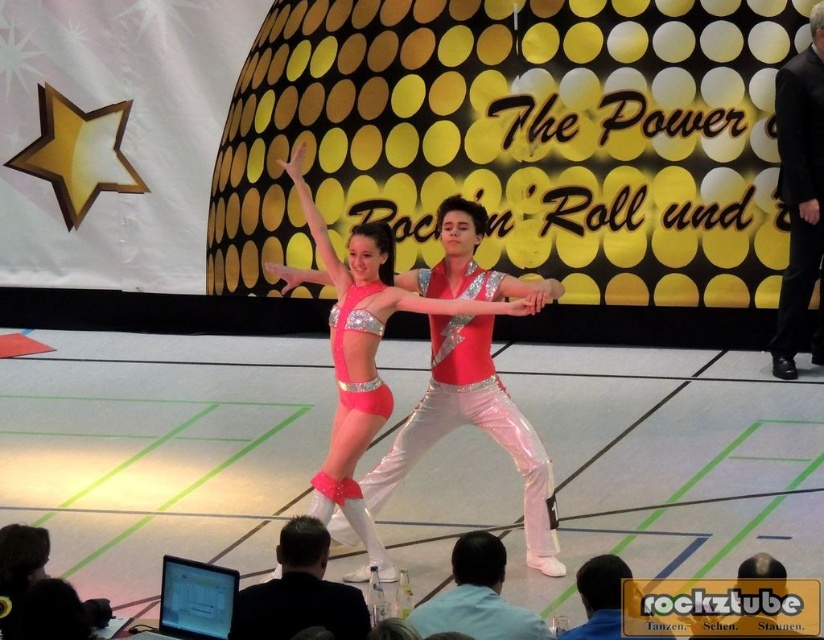
You are a stagehand preparing to move a large prop that is 1 meter wide. You need to place it on the stage between the black leather jacket at lower center and the light blue shirt at lower center. Will the space between them be wide enough to accommodate the prop?

The black leather jacket at lower center has a lesser width compared to light blue shirt at lower center. The combined width of both objects is not specified, but since the jacket is narrower, the space between them might not be sufficient for a 1 meter wide prop. However, without exact measurements of the gap, it is uncertain. Please verify the actual distance on the stage.

You are a stagehand standing at the edge of the stage. You need to place a 1.2 meter long ladder to reach the black velvet suit at upper right for adjustments. Is the ladder long enough to reach it?

The black velvet suit at upper right is 8.87 meters away from the viewer. Since the ladder is only 1.2 meters long, it is not long enough to reach the black velvet suit at upper right for adjustments.